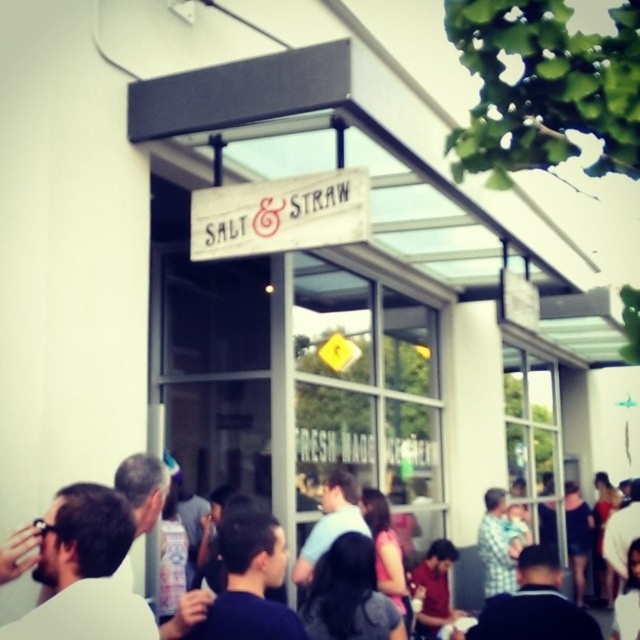
You are standing in front of the Salt and Straw building and want to reach a point that is 14.53 feet away from you. Can you determine if the point at coordinates point (x=202, y=230) is the correct location?

The point (x=202, y=230) is 14.53 feet away from the viewer, so yes, it is the correct location.

You are a photographer trying to capture the Salt and Straw sign and the person in the dark blue shirt in the same frame. Based on the scene, will the white wood sign at center be wider than the dark blue shirt at center in your photo?

The white wood sign at center is wider than the dark blue shirt at center, so yes, the sign will appear wider in the photo.